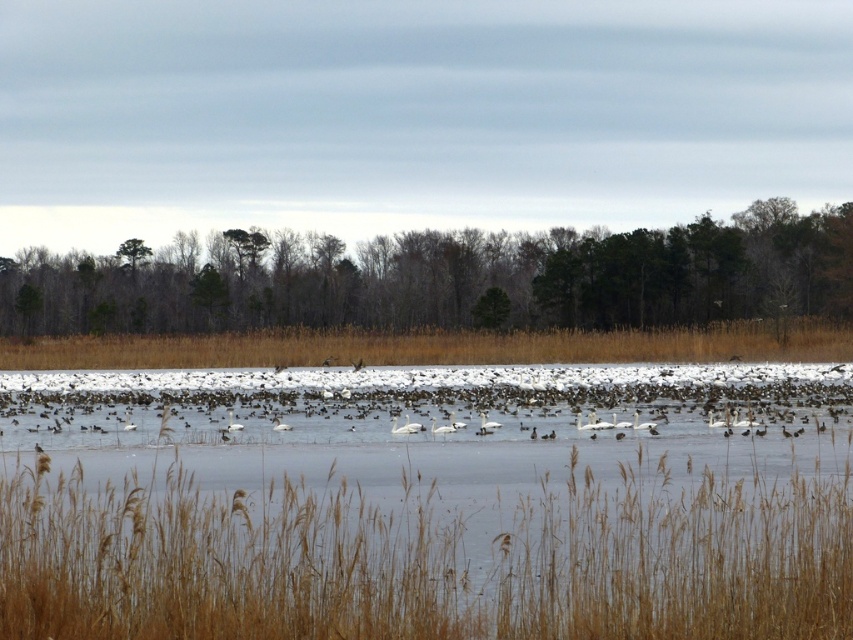
Between brown dry grass at lower center and white glossy swan at center, which one has more height?

With more height is brown dry grass at lower center.

Is brown dry grass at lower center to the left of white glossy swan at center from the viewer's perspective?

Incorrect, brown dry grass at lower center is not on the left side of white glossy swan at center.

Is point (117, 518) positioned before point (405, 428)?

Yes, point (117, 518) is closer to viewer.

Find the location of a particular element. This screenshot has width=853, height=640. brown dry grass at lower center is located at coordinates (425, 557).

Can you confirm if brown/dry grass at center is positioned to the left of white glossy swan at center?

Yes, brown/dry grass at center is to the left of white glossy swan at center.

Is brown/dry grass at center positioned in front of white glossy swan at center?

No, brown/dry grass at center is behind white glossy swan at center.

This screenshot has width=853, height=640. What do you see at coordinates (448, 280) in the screenshot?
I see `brown/dry grass at center` at bounding box center [448, 280].

Identify the location of brown/dry grass at center. This screenshot has width=853, height=640. (x=448, y=280).

Does brown dry grass at lower center appear over brown/dry grass at center?

No, brown dry grass at lower center is not above brown/dry grass at center.

Is point (773, 518) behind point (642, 321)?

No, (773, 518) is closer to viewer.

Does point (830, 616) come closer to viewer compared to point (36, 323)?

Yes, point (830, 616) is in front of point (36, 323).

Locate an element on the screen. brown dry grass at lower center is located at coordinates (425, 557).